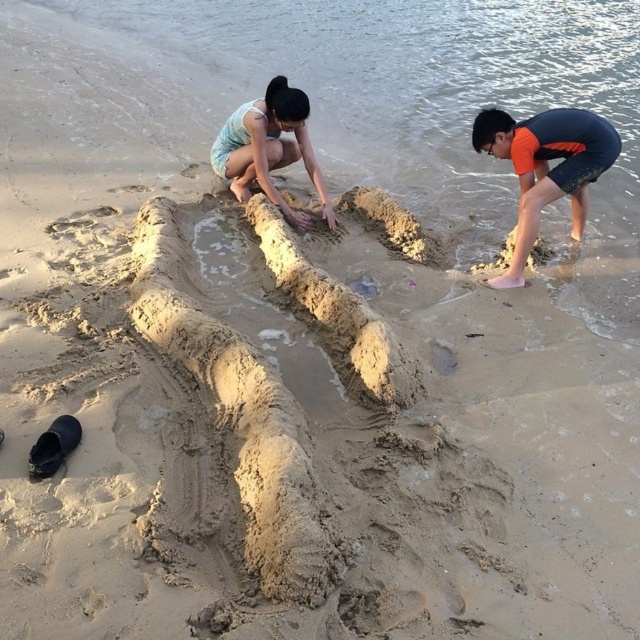
Is orange fabric at right wider than light blue fabric at center?

Correct, the width of orange fabric at right exceeds that of light blue fabric at center.

Which is in front, point (518, 172) or point (289, 88)?

Point (518, 172) is in front.

The image size is (640, 640). What do you see at coordinates (545, 168) in the screenshot? I see `orange fabric at right` at bounding box center [545, 168].

The width and height of the screenshot is (640, 640). I want to click on orange fabric at right, so click(545, 168).